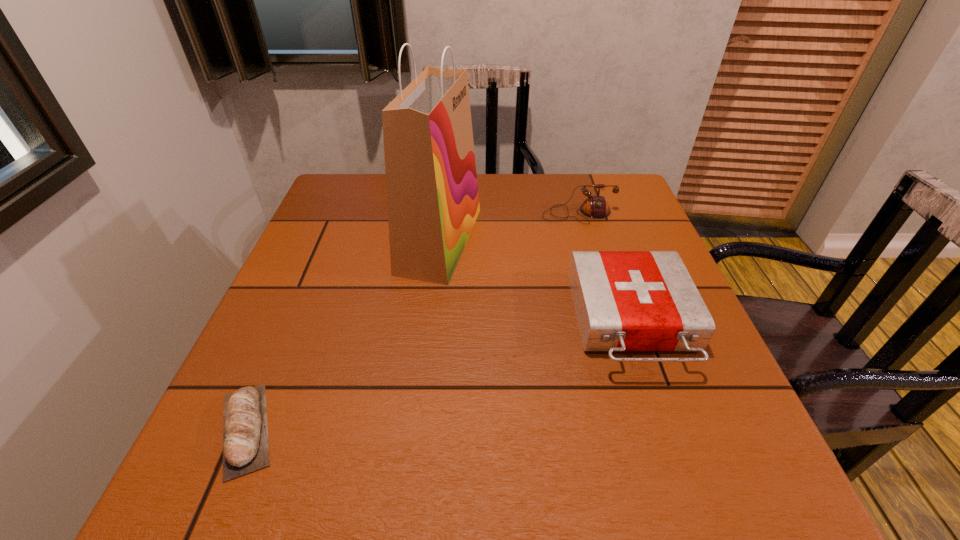
Identify the location of shopping bag. Image resolution: width=960 pixels, height=540 pixels. (432, 192).

Where is `the tallest object`? This screenshot has width=960, height=540. the tallest object is located at coordinates (432, 192).

The image size is (960, 540). I want to click on telephone, so click(595, 206).

Locate an element on the screen. The height and width of the screenshot is (540, 960). the first-aid kit is located at coordinates (624, 300).

Identify the location of the nearest object. (245, 429).

Locate an element on the screen. The width and height of the screenshot is (960, 540). pita bread is located at coordinates (245, 429).

Locate an element on the screen. The height and width of the screenshot is (540, 960). free spot located 0.240m on the right of the shopping bag is located at coordinates (577, 240).

Where is `vacant space positioned on the rotary dial of the telephone`? vacant space positioned on the rotary dial of the telephone is located at coordinates (590, 255).

You are a GUI agent. You are given a task and a screenshot of the screen. Output one action in this format:
    pyautogui.click(x=<x>, y=<y>)
    Task: Click on the free spot located on the front side of the first-aid kit
    The width and height of the screenshot is (960, 540).
    Given the screenshot: What is the action you would take?
    pyautogui.click(x=695, y=504)

Where is `vacant point located on the right of the shortest object`? vacant point located on the right of the shortest object is located at coordinates (523, 429).